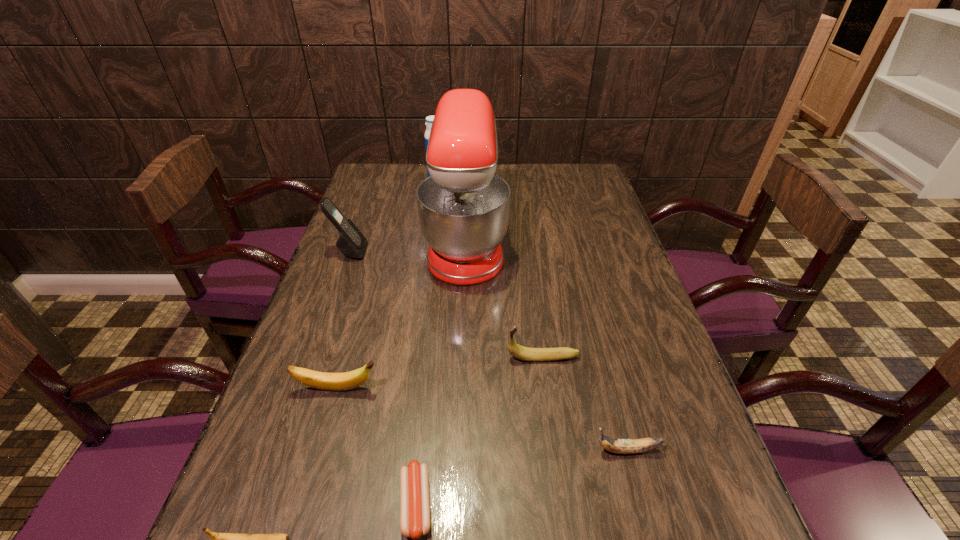
Locate an element on the screen. The image size is (960, 540). vacant area located at the stem of the fourth farthest object is located at coordinates (392, 358).

Find the location of a particular element. The width and height of the screenshot is (960, 540). vacant region located at the stem of the fourth farthest object is located at coordinates (396, 358).

Locate an element on the screen. This screenshot has height=540, width=960. free space located at the stem of the fourth farthest object is located at coordinates [419, 358].

Locate an element on the screen. free space located at the stem of the second farthest banana is located at coordinates click(436, 388).

Locate an element on the screen. This screenshot has height=540, width=960. free space located 0.340m at the stem of the second nearest banana is located at coordinates (414, 450).

Where is `free space located at the stem of the second nearest banana`? The image size is (960, 540). free space located at the stem of the second nearest banana is located at coordinates (563, 450).

Identify the location of free region located 0.310m at the stem of the second nearest banana. (429, 450).

The width and height of the screenshot is (960, 540). What are the coordinates of `object at the far edge` in the screenshot? It's located at (429, 119).

Locate an element on the screen. This screenshot has height=540, width=960. cellular telephone that is at the left edge is located at coordinates (351, 242).

Find the location of a particular element. This screenshot has height=540, width=960. banana situated at the left edge is located at coordinates (348, 380).